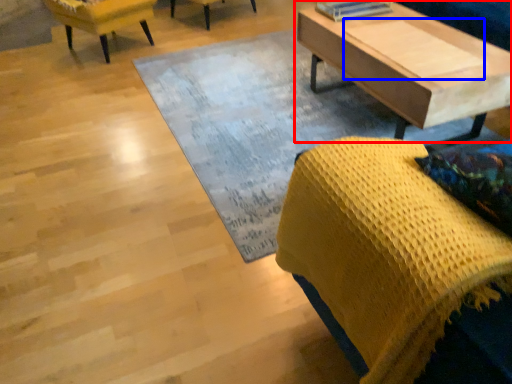
Question: Which point is closer to the camera, coffee table (highlighted by a red box) or plank (highlighted by a blue box)?

Choices:
 (A) coffee table
 (B) plank

Answer: (A)